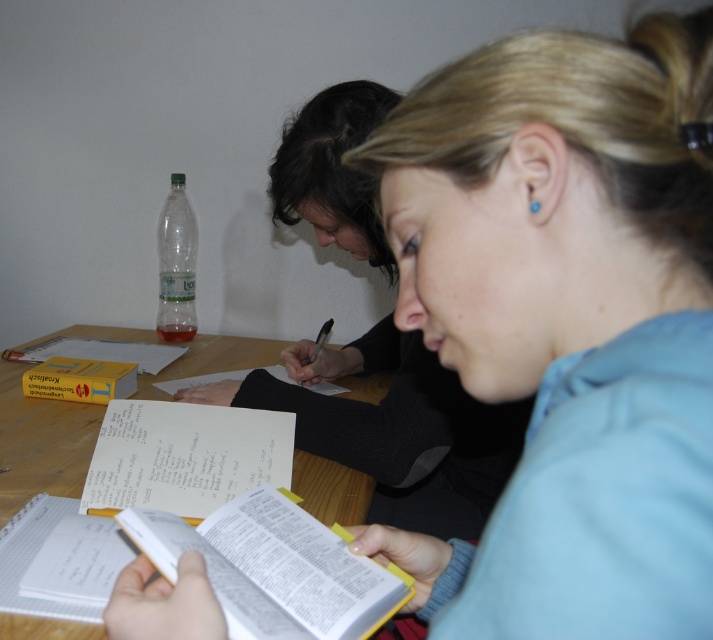
Can you confirm if smooth black sweater at center is taller than wooden table at center?

Correct, smooth black sweater at center is much taller as wooden table at center.

Is point (389, 468) in front of point (39, 634)?

No.

Who is more distant from viewer, (443, 515) or (61, 632)?

Positioned behind is point (443, 515).

This screenshot has height=640, width=713. I want to click on smooth black sweater at center, so click(394, 428).

Between point (374, 330) and point (168, 324), which one is positioned behind?

The point (168, 324) is more distant.

Between point (364, 221) and point (174, 184), which one is positioned in front?

Point (364, 221) is in front.

What do you see at coordinates (394, 428) in the screenshot? The height and width of the screenshot is (640, 713). I see `smooth black sweater at center` at bounding box center [394, 428].

I want to click on smooth black sweater at center, so click(x=394, y=428).

Can you confirm if white paper book at center is taller than wooden table at center?

No.

Does point (153, 538) come in front of point (337, 508)?

Yes, it is.

At what (x,y) coordinates should I click in order to perform the action: click on white paper book at center. Please return your answer as a coordinate pair (x, y). Looking at the image, I should click on (275, 568).